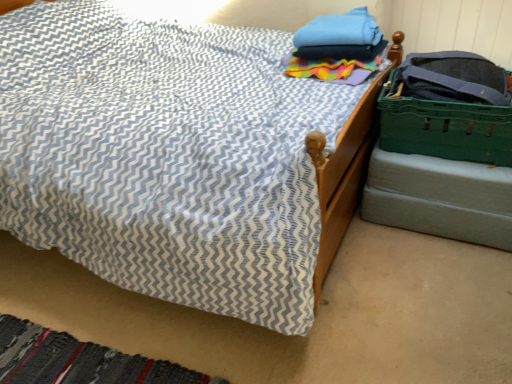
Question: In the image, is textured fabric bed at center positioned in front of or behind blue cotton towels at upper right?

Choices:
 (A) front
 (B) behind

Answer: (A)

Question: From the image's perspective, is textured fabric bed at center located above or below blue cotton towels at upper right?

Choices:
 (A) below
 (B) above

Answer: (A)

Question: Which object is the closest to the textured fabric bed at center?

Choices:
 (A) green plastic crate at lower right
 (B) blue cotton towels at upper right
 (C) green plastic crate at right

Answer: (B)

Question: Which of these objects is positioned closest to the green plastic crate at right?

Choices:
 (A) green plastic crate at lower right
 (B) blue cotton towels at upper right
 (C) textured fabric bed at center

Answer: (A)